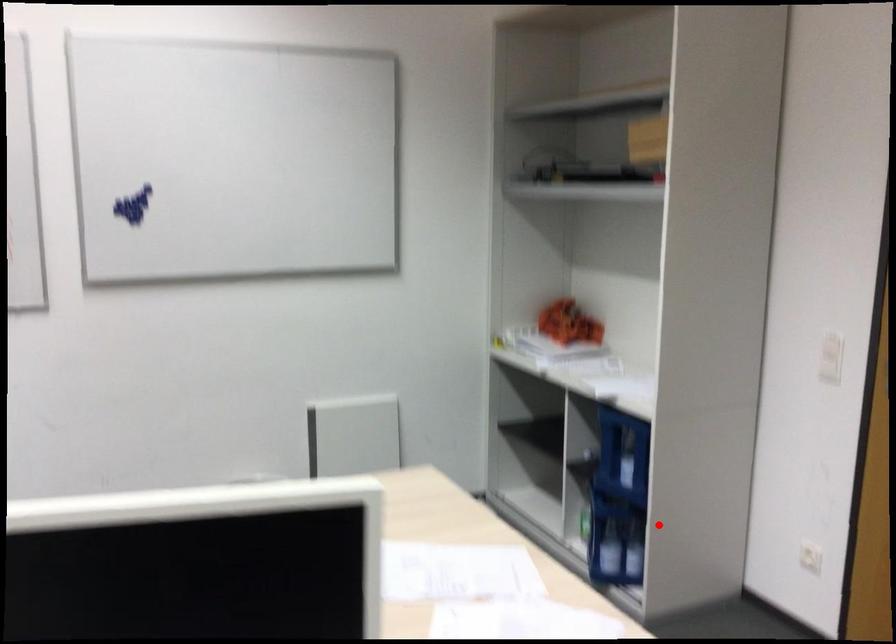
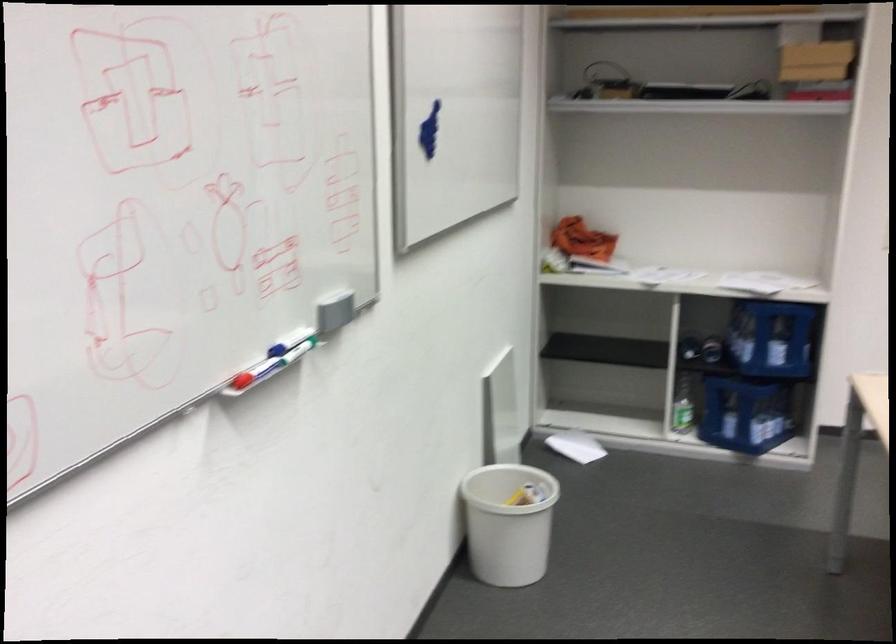
Question: I am providing you with two images of the same scene from different viewpoints. Image1 has a red point marked. In image2, the corresponding 3D location appears at what relative position? Reply with the corresponding letter.

Choices:
 (A) Closer
 (B) Farther

Answer: (B)